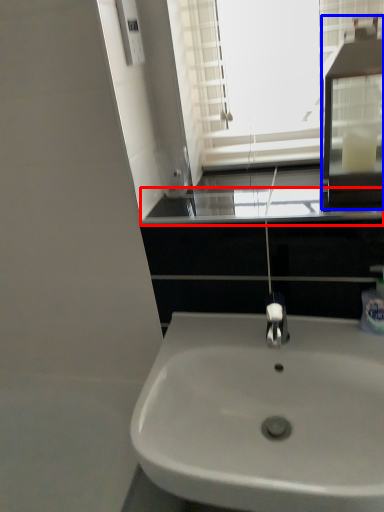
Question: Among these objects, which one is farthest to the camera, window sill (highlighted by a red box) or medicine cabinet (highlighted by a blue box)?

Choices:
 (A) window sill
 (B) medicine cabinet

Answer: (A)